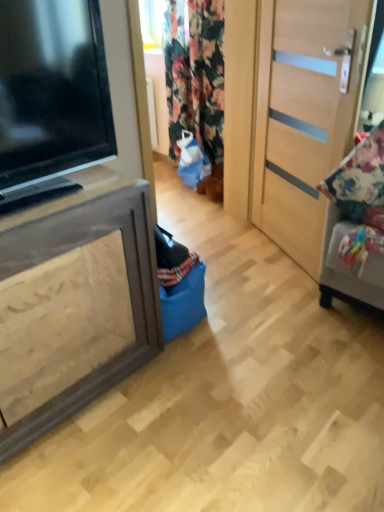
Identify the location of vacant space underneath black glossy television at left (from a real-world perspective). The height and width of the screenshot is (512, 384). (45, 184).